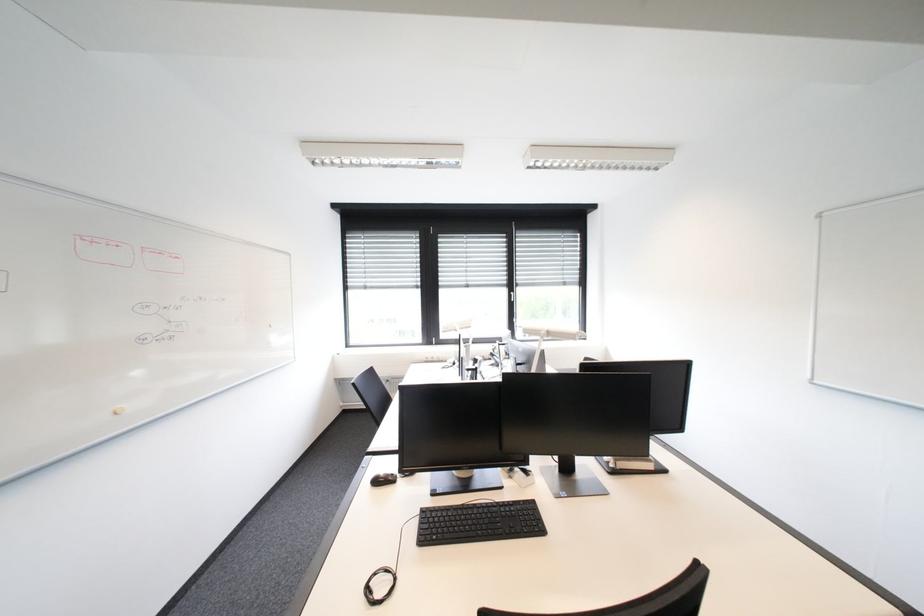
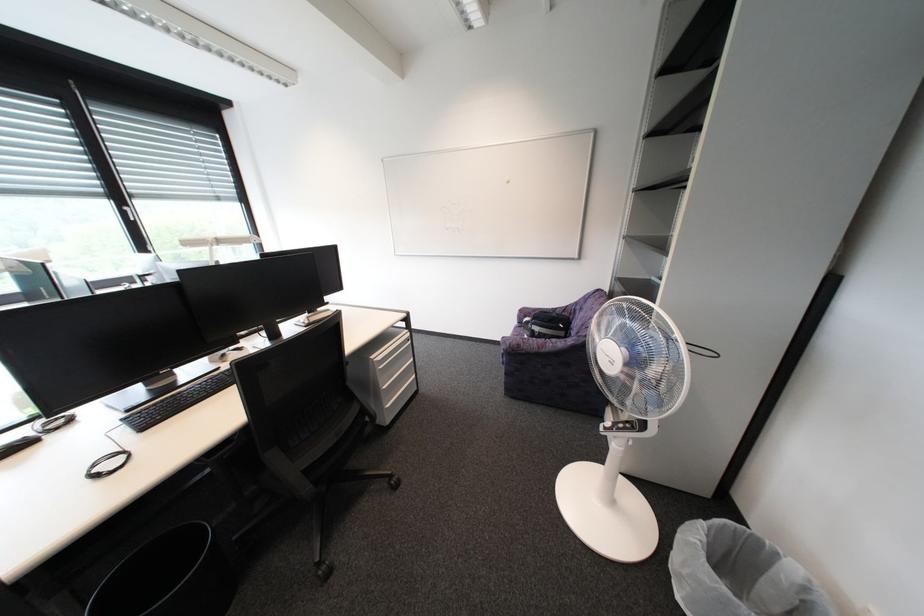
The images are taken continuously from a first-person perspective. In which direction is your viewpoint rotating?

The camera rotated toward right-down.